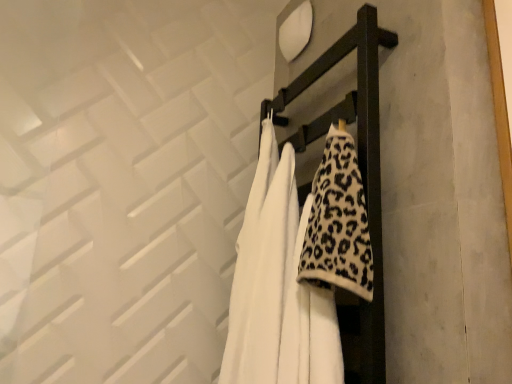
What do you see at coordinates (338, 223) in the screenshot? I see `leopard print fleece blanket at center` at bounding box center [338, 223].

The height and width of the screenshot is (384, 512). I want to click on leopard print fleece blanket at center, so click(338, 223).

I want to click on leopard print fleece blanket at center, so click(x=338, y=223).